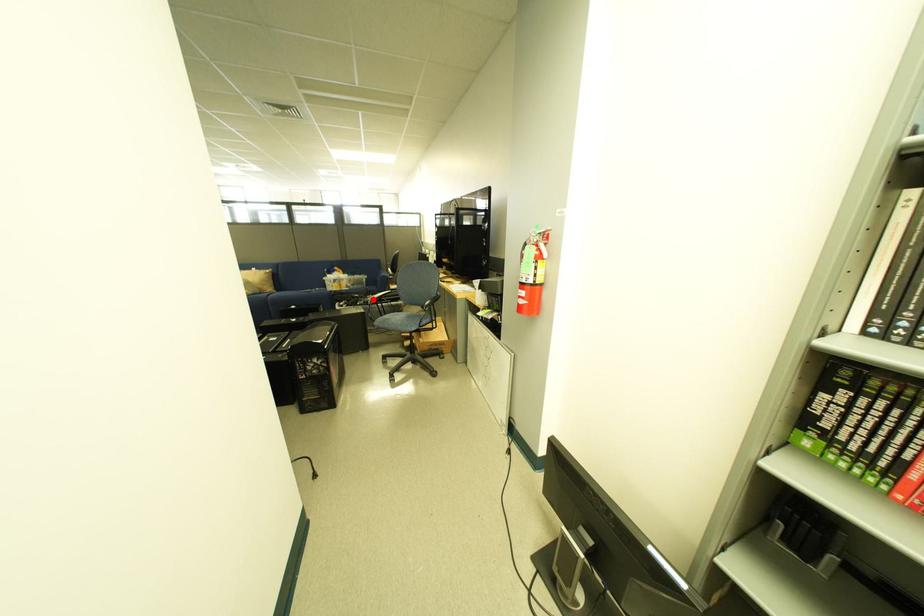
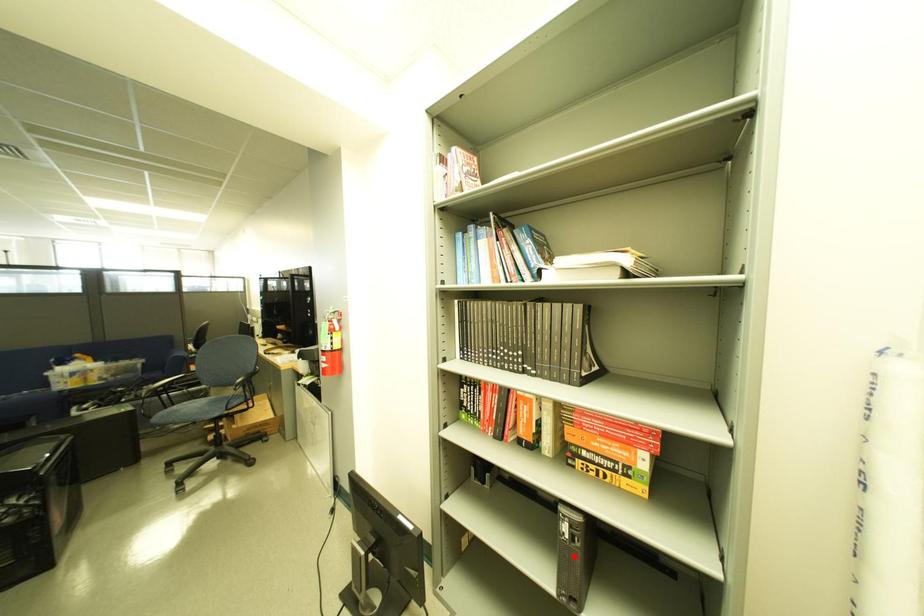
I am providing you with two images of the same scene from different viewpoints. A red point is marked on the first image and another point is marked on the second image. Is the red point in image1 aligned with the point shown in image2?

No